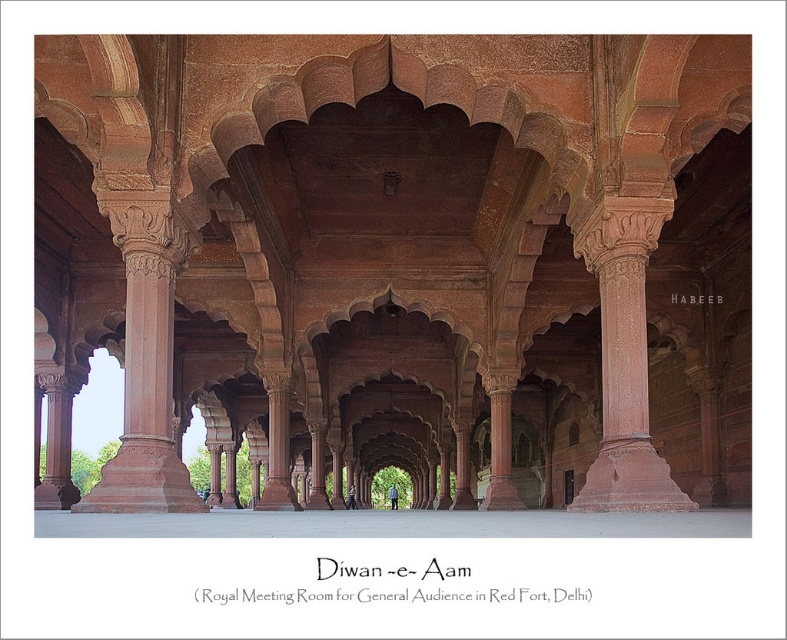
Question: Does red sandstone arches at center have a larger size compared to rustic stone column at center?

Choices:
 (A) yes
 (B) no

Answer: (A)

Question: From the image, what is the correct spatial relationship of red sandstone arches at center in relation to rustic stone column at center?

Choices:
 (A) right
 (B) left

Answer: (B)

Question: Can you confirm if red sandstone arches at center is positioned below rustic stone column at center?

Choices:
 (A) no
 (B) yes

Answer: (B)

Question: Among these objects, which one is nearest to the camera?

Choices:
 (A) rustic stone column at center
 (B) red sandstone arches at center

Answer: (A)